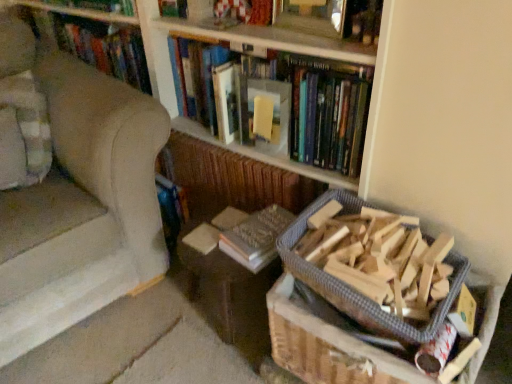
The height and width of the screenshot is (384, 512). What are the coordinates of `vacant space in front of yellow paper at upper center` in the screenshot? It's located at (279, 170).